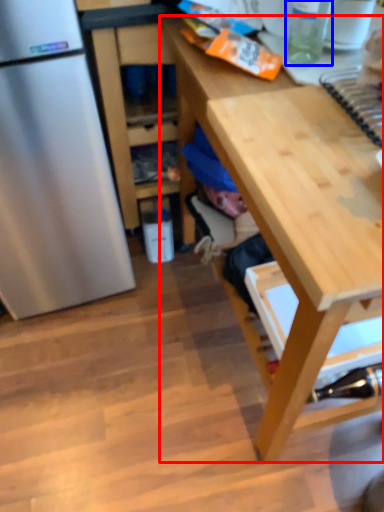
Question: Which point is closer to the camera, desk (highlighted by a red box) or bottle (highlighted by a blue box)?

Choices:
 (A) desk
 (B) bottle

Answer: (A)